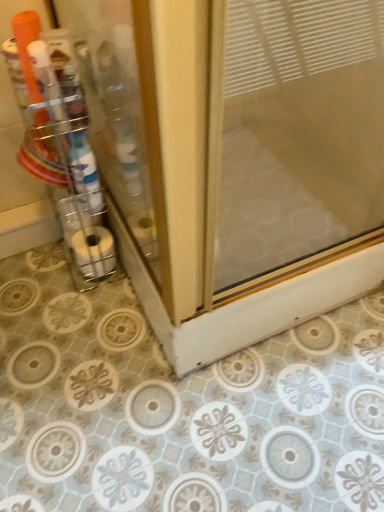
Image resolution: width=384 pixels, height=512 pixels. Describe the element at coordinates (94, 251) in the screenshot. I see `white matte toilet paper at lower left` at that location.

You are a GUI agent. You are given a task and a screenshot of the screen. Output one action in this format:
    pyautogui.click(x=<x>, y=<y>)
    Task: Click on the white matte toilet paper at lower left
    The height and width of the screenshot is (512, 384).
    Given the screenshot: What is the action you would take?
    pyautogui.click(x=94, y=251)

The height and width of the screenshot is (512, 384). Find the location of `white matte toilet paper at lower left`. white matte toilet paper at lower left is located at coordinates (94, 251).